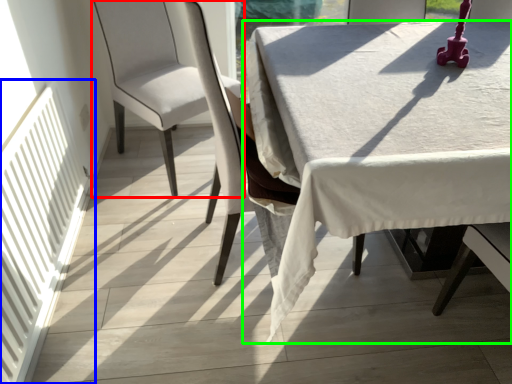
Question: Which object is the farthest from chair (highlighted by a red box)? Choose among these: radiator (highlighted by a blue box) or table (highlighted by a green box).

Choices:
 (A) radiator
 (B) table

Answer: (B)